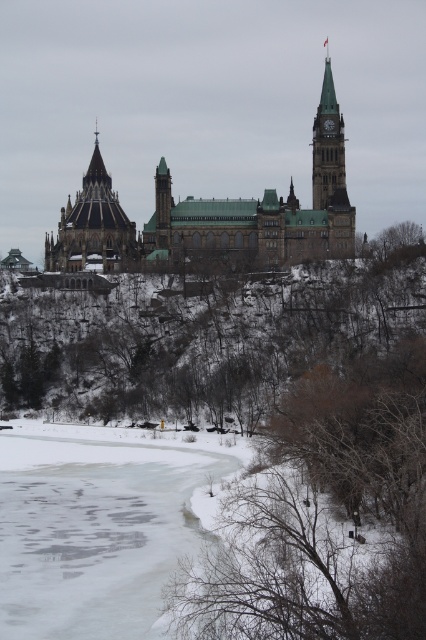
Looking at this image, does frozen ice at lower left appear on the right side of green stone clock tower at upper center?

No, frozen ice at lower left is not to the right of green stone clock tower at upper center.

Is frozen ice at lower left smaller than green stone clock tower at upper center?

Incorrect, frozen ice at lower left is not smaller in size than green stone clock tower at upper center.

The height and width of the screenshot is (640, 426). What do you see at coordinates (97, 525) in the screenshot?
I see `frozen ice at lower left` at bounding box center [97, 525].

The width and height of the screenshot is (426, 640). I want to click on frozen ice at lower left, so click(97, 525).

Does frozen ice at lower left have a larger size compared to dark brown stone tower at upper left?

Yes.

Between point (124, 625) and point (121, 257), which one is positioned in front?

Point (124, 625)

What do you see at coordinates (97, 525) in the screenshot?
I see `frozen ice at lower left` at bounding box center [97, 525].

Locate an element on the screen. frozen ice at lower left is located at coordinates (97, 525).

Can you confirm if frozen ice at lower left is positioned below brown stone castle at center?

Yes, frozen ice at lower left is below brown stone castle at center.

Identify the location of frozen ice at lower left. This screenshot has width=426, height=640. (97, 525).

Image resolution: width=426 pixels, height=640 pixels. Identify the location of frozen ice at lower left. (97, 525).